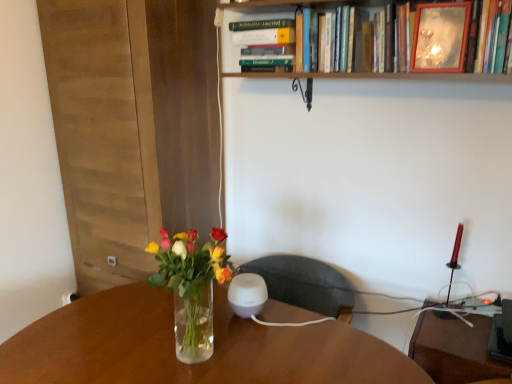
Identify the location of wooden picture frame at upper right. (440, 37).

The width and height of the screenshot is (512, 384). What do you see at coordinates (387, 38) in the screenshot? I see `wooden frame mirror at upper center, the first book positioned from the right` at bounding box center [387, 38].

In order to click on wooden frame mirror at upper center, positioned as the 2th book in left-to-right order in this screenshot , I will do `click(387, 38)`.

At what (x,y) coordinates should I click in order to perform the action: click on hardcover book at upper center, the second book viewed from the right. Please return your answer as a coordinate pair (x, y). Looking at the image, I should click on (265, 44).

Is translucent glass vase at center not near hardcover book at upper center, the second book viewed from the right?

translucent glass vase at center is actually quite close to hardcover book at upper center, the second book viewed from the right.

Is translucent glass vase at center looking in the opposite direction of hardcover book at upper center, which ranks as the 1th book in left-to-right order?

That's not correct — translucent glass vase at center is not looking away from hardcover book at upper center, which ranks as the 1th book in left-to-right order.

Is translucent glass vase at center wider than hardcover book at upper center, which ranks as the 1th book in left-to-right order?

No, translucent glass vase at center is not wider than hardcover book at upper center, which ranks as the 1th book in left-to-right order.

Is point (214, 250) closer to viewer compared to point (269, 26)?

That is True.

Is translucent glass vase at center inside wooden picture frame at upper right?

No, wooden picture frame at upper right does not contain translucent glass vase at center.

Which is more to the right, wooden picture frame at upper right or translucent glass vase at center?

Positioned to the right is wooden picture frame at upper right.

Is wooden picture frame at upper right directly adjacent to translucent glass vase at center?

They are not placed beside each other.

Which is in front, hardcover book at upper center, which ranks as the 1th book in left-to-right order, or translucent glass vase at center?

translucent glass vase at center is in front.

From a real-world perspective, is hardcover book at upper center, the second book viewed from the right, positioned above or below translucent glass vase at center?

hardcover book at upper center, the second book viewed from the right, is above translucent glass vase at center.

Is hardcover book at upper center, the second book viewed from the right, not close to translucent glass vase at center?

They are positioned close to each other.

Based on their sizes in the image, would you say wooden picture frame at upper right is bigger or smaller than hardcover book at upper center, the second book viewed from the right?

In the image, wooden picture frame at upper right appears to be smaller than hardcover book at upper center, the second book viewed from the right.

From the image's perspective, which one is positioned lower, wooden picture frame at upper right or hardcover book at upper center, the second book viewed from the right?

wooden picture frame at upper right.

Between wooden picture frame at upper right and hardcover book at upper center, which ranks as the 1th book in left-to-right order, which one has larger width?

hardcover book at upper center, which ranks as the 1th book in left-to-right order, is wider.

Is wooden picture frame at upper right outside of wooden frame mirror at upper center, positioned as the 2th book in left-to-right order?

Actually, wooden picture frame at upper right is at least partially inside wooden frame mirror at upper center, positioned as the 2th book in left-to-right order.

From a real-world perspective, who is located lower, wooden picture frame at upper right or wooden frame mirror at upper center, the first book positioned from the right?

wooden picture frame at upper right is physically lower.

Who is taller, wooden picture frame at upper right or wooden frame mirror at upper center, positioned as the 2th book in left-to-right order?

wooden frame mirror at upper center, positioned as the 2th book in left-to-right order, is taller.

This screenshot has height=384, width=512. Find the location of `the 1st book behind when counting from the translucent glass vase at center`. the 1st book behind when counting from the translucent glass vase at center is located at coordinates (387, 38).

From a real-world perspective, is wooden frame mirror at upper center, positioned as the 2th book in left-to-right order, physically below translucent glass vase at center?

No.

How different are the orientations of wooden frame mirror at upper center, the first book positioned from the right, and translucent glass vase at center in degrees?

1.44 degrees separate the facing orientations of wooden frame mirror at upper center, the first book positioned from the right, and translucent glass vase at center.

Is wooden frame mirror at upper center, the first book positioned from the right, with translucent glass vase at center?

wooden frame mirror at upper center, the first book positioned from the right, and translucent glass vase at center are clearly separated.

From the picture: Considering the positions of objects wooden frame mirror at upper center, positioned as the 2th book in left-to-right order, and hardcover book at upper center, the second book viewed from the right, in the image provided, who is more to the left, wooden frame mirror at upper center, positioned as the 2th book in left-to-right order, or hardcover book at upper center, the second book viewed from the right,?

Positioned to the left is hardcover book at upper center, the second book viewed from the right.

Is wooden frame mirror at upper center, the first book positioned from the right, oriented towards hardcover book at upper center, which ranks as the 1th book in left-to-right order?

No, wooden frame mirror at upper center, the first book positioned from the right, is not turned towards hardcover book at upper center, which ranks as the 1th book in left-to-right order.

From a real-world perspective, is wooden frame mirror at upper center, the first book positioned from the right, on top of hardcover book at upper center, the second book viewed from the right?

Yes.

Locate an element on the screen. floral arrangement below the hardcover book at upper center, which ranks as the 1th book in left-to-right order (from a real-world perspective) is located at coordinates (191, 286).

Identify the location of picture frame located behind the translucent glass vase at center. The width and height of the screenshot is (512, 384). (440, 37).

When comparing their distances from translucent glass vase at center, does hardcover book at upper center, the second book viewed from the right, or wooden frame mirror at upper center, positioned as the 2th book in left-to-right order, seem further?

wooden frame mirror at upper center, positioned as the 2th book in left-to-right order, lies further to translucent glass vase at center than the other object.

Estimate the real-world distances between objects in this image. Which object is closer to hardcover book at upper center, which ranks as the 1th book in left-to-right order, wooden picture frame at upper right or wooden frame mirror at upper center, positioned as the 2th book in left-to-right order?

wooden frame mirror at upper center, positioned as the 2th book in left-to-right order.

Considering their positions, is wooden frame mirror at upper center, positioned as the 2th book in left-to-right order, positioned further to hardcover book at upper center, which ranks as the 1th book in left-to-right order, than wooden picture frame at upper right?

Among the two, wooden picture frame at upper right is located further to hardcover book at upper center, which ranks as the 1th book in left-to-right order.

From the image, which object appears to be farther from wooden frame mirror at upper center, positioned as the 2th book in left-to-right order, hardcover book at upper center, which ranks as the 1th book in left-to-right order, or wooden picture frame at upper right?

Based on the image, hardcover book at upper center, which ranks as the 1th book in left-to-right order, appears to be further to wooden frame mirror at upper center, positioned as the 2th book in left-to-right order.

Considering their positions, is translucent glass vase at center positioned closer to hardcover book at upper center, the second book viewed from the right, than wooden picture frame at upper right?

wooden picture frame at upper right lies closer to hardcover book at upper center, the second book viewed from the right, than the other object.

When comparing their distances from hardcover book at upper center, the second book viewed from the right, does wooden picture frame at upper right or translucent glass vase at center seem closer?

wooden picture frame at upper right is positioned closer to the anchor hardcover book at upper center, the second book viewed from the right.

Considering their positions, is translucent glass vase at center positioned closer to wooden picture frame at upper right than hardcover book at upper center, the second book viewed from the right?

hardcover book at upper center, the second book viewed from the right, is positioned closer to the anchor wooden picture frame at upper right.

Looking at the image, which one is located further to wooden picture frame at upper right, wooden frame mirror at upper center, positioned as the 2th book in left-to-right order, or translucent glass vase at center?

Based on the image, translucent glass vase at center appears to be further to wooden picture frame at upper right.

What are the coordinates of `book between hardcover book at upper center, which ranks as the 1th book in left-to-right order, and translucent glass vase at center from top to bottom` in the screenshot? It's located at pos(387,38).

Identify the location of book located between hardcover book at upper center, which ranks as the 1th book in left-to-right order, and wooden picture frame at upper right in the left-right direction. (387, 38).

This screenshot has width=512, height=384. What are the coordinates of `picture frame between hardcover book at upper center, which ranks as the 1th book in left-to-right order, and translucent glass vase at center, in the vertical direction` in the screenshot? It's located at (440, 37).

Identify the location of picture frame between wooden frame mirror at upper center, positioned as the 2th book in left-to-right order, and translucent glass vase at center from top to bottom. The width and height of the screenshot is (512, 384). (440, 37).